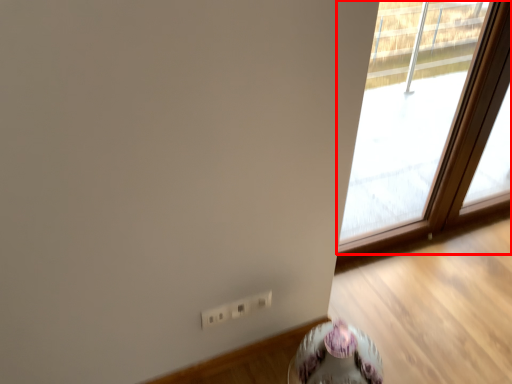
Question: From the image's perspective, considering the relative positions of window (annotated by the red box) and round table in the image provided, where is window (annotated by the red box) located with respect to the staircase?

Choices:
 (A) below
 (B) above

Answer: (B)